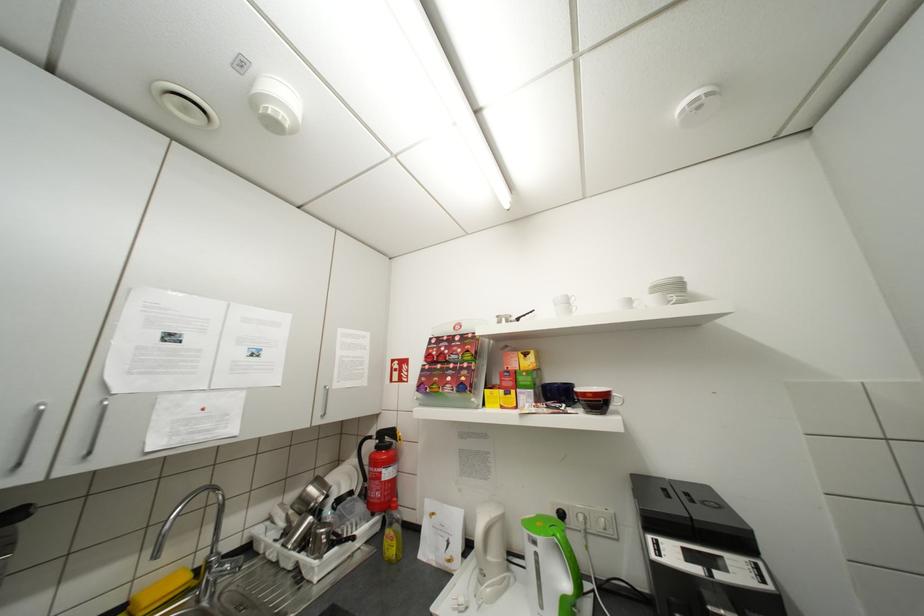
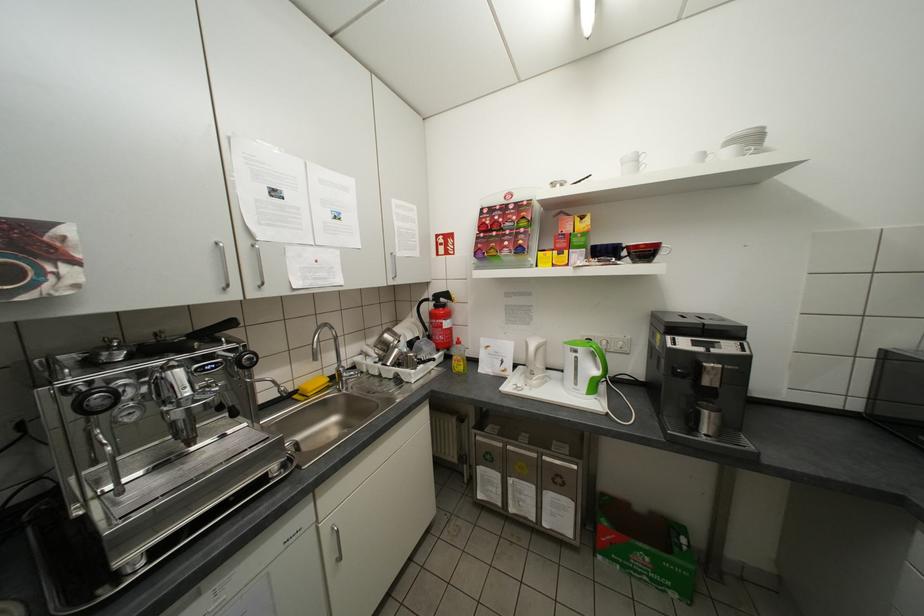
Locate, in the second image, the point that corresponds to the point at 385,447 in the first image.

(444, 306)